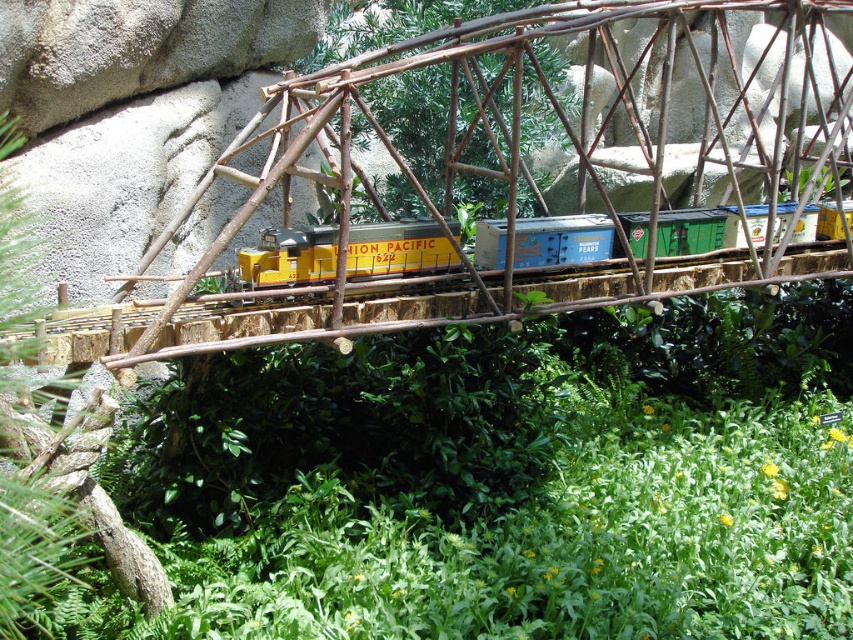
You are a model train enthusiast who wants to add a new car to the existing train. The new car is 1.5 times taller than the yellow matte train car at center. Will the new car fit under the brown textured wood bridge at center without any modifications?

The brown textured wood bridge at center is much taller than the yellow matte train car at center. Since the new car is only 1.5 times taller than the yellow matte train car at center, it should still fit under the bridge as long as the bridge height allows for the increased height. However, exact measurements would be needed to confirm.

You are a photographer standing in front of the model train scene. You want to take a photo that includes both the point at coordinates point (398, 29) and point (804, 257). Which point is closer to you, the photographer?

The point at coordinates point (398, 29) is closer to you than the point at coordinates point (804, 257) because it is further to the viewer.